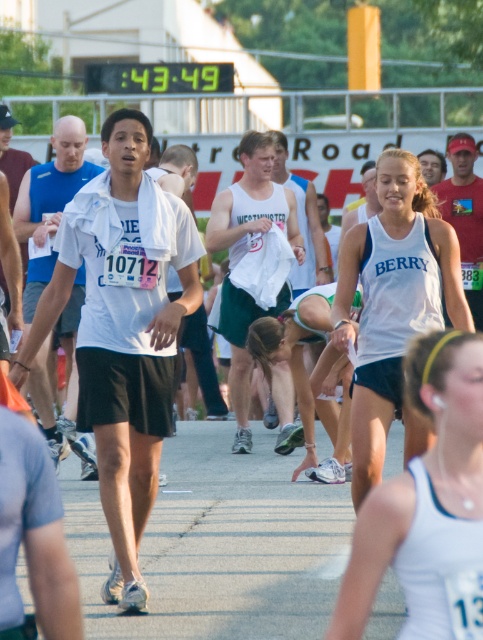
In the running event scene, there are two runners wearing white tops. The first runner has a white matte shirt at center with the number 10712, and the second runner has a white tank top at center with the word BERRY. From the perspective of someone watching the race from the starting line, which runner is positioned to the left?

The white matte shirt at center is to the left of the white tank top at center, so the runner with the white matte shirt at center is positioned to the left.

You are a photographer at the race and want to capture both the white matte shirt at center and the white tank top at center in a single shot. Can you position yourself so that neither of them is blocking the other?

The white tank top at center is behind the white matte shirt at center, so if you position yourself in front of them, the white matte shirt at center will block the white tank top at center. To avoid blocking, you need to position yourself behind the white matte shirt at center so that you can see both, but since the white tank top at center is already behind the white matte shirt at center, this might not be possible without moving them.

You are a photographer at the race and want to capture both the white matte shirt at center and the white tank top at center in the same frame. Which runner should you position closer to the camera to ensure both are fully visible?

The white matte shirt at center is much taller than the white tank top at center, so positioning the white matte shirt at center closer to the camera will help balance their sizes in the photo.